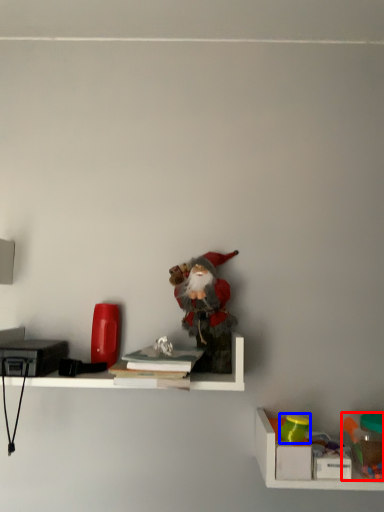
Question: Which of the following is the farthest to the observer, toy (highlighted by a red box) or toy (highlighted by a blue box)?

Choices:
 (A) toy
 (B) toy

Answer: (B)